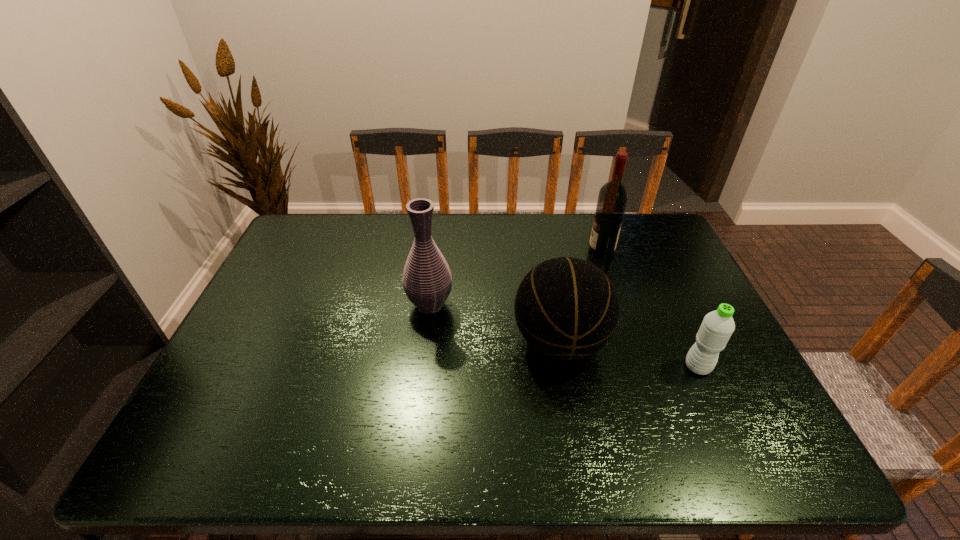
In the image, there is a desktop. Where is `vacant space at the near left corner`? Image resolution: width=960 pixels, height=540 pixels. vacant space at the near left corner is located at coordinates (207, 457).

This screenshot has width=960, height=540. Identify the location of vacant area that lies between the basketball and the water bottle. (629, 354).

Identify the location of free point between the shortest object and the alcohol. Image resolution: width=960 pixels, height=540 pixels. (650, 309).

Identify the location of empty space that is in between the leftmost object and the second shortest object. (494, 323).

Where is `free point between the alcohol and the leftmost object`? free point between the alcohol and the leftmost object is located at coordinates (516, 278).

What are the coordinates of `vacant space in between the shortest object and the basketball` in the screenshot? It's located at (x=629, y=354).

Where is `vacant space that is in between the second object from left to right and the leftmost object`? vacant space that is in between the second object from left to right and the leftmost object is located at coordinates (494, 323).

Locate which object is the second closest to the rightmost object. Please provide its 2D coordinates. Your answer should be formatted as a tuple, i.e. [(x, y)], where the tuple contains the x and y coordinates of a point satisfying the conditions above.

[(613, 195)]

At what (x,y) coordinates should I click in order to perform the action: click on object that is the second closest to the water bottle. Please return your answer as a coordinate pair (x, y). The width and height of the screenshot is (960, 540). Looking at the image, I should click on (613, 195).

The image size is (960, 540). I want to click on vacant space that satisfies the following two spatial constraints: 1. on the front and back of the alcohol; 2. on the back side of the rightmost object, so click(640, 367).